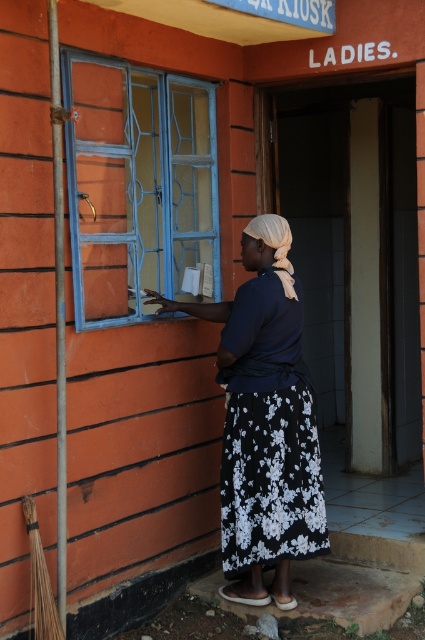
You are a delivery person trying to hand over a package through the blue painted glass window at left and the black floral skirt at center. Which object is bigger in size?

The blue painted glass window at left has a larger size compared to the black floral skirt at center, so the blue painted glass window at left is bigger in size.

In the scene shown: You are a fashion designer observing a woman outside a building with orange walls. She is wearing two items from your collection. You notice the black floral skirt at center and the black floral fabric dress at center. Which item is longer in length?

The black floral skirt at center is taller than the black floral fabric dress at center, so the skirt is longer in length.

You are a fashion designer observing a woman wearing a black floral skirt at center and a black floral fabric dress at center. Which item of clothing has a greater width?

The black floral skirt at center has a greater width than the black floral fabric dress at center according to the description.